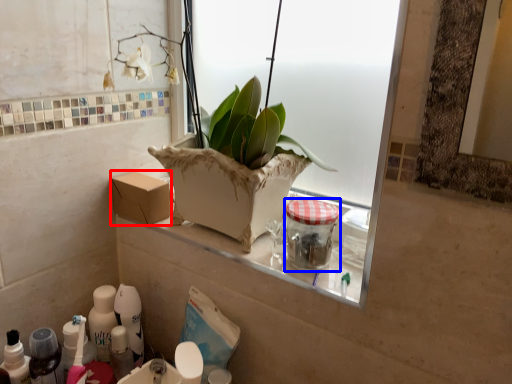
Question: Which object is closer to the camera taking this photo, cardboard box (highlighted by a red box) or glass jar (highlighted by a blue box)?

Choices:
 (A) cardboard box
 (B) glass jar

Answer: (B)